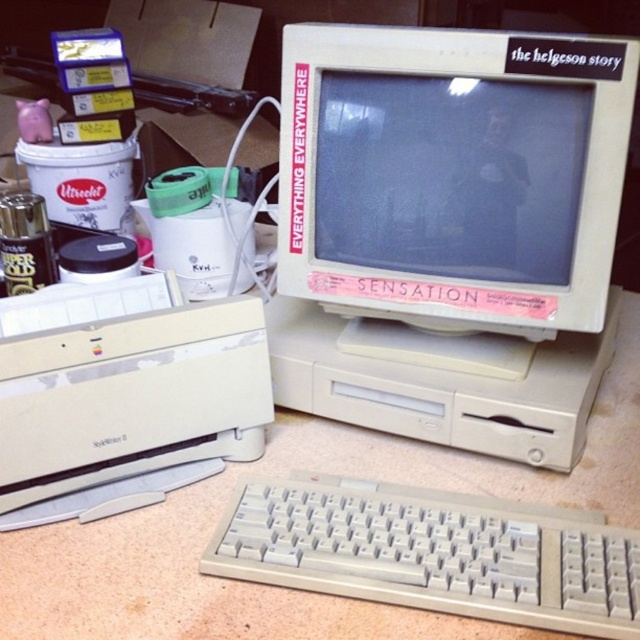
Question: Does white plastic monitor at center have a greater width compared to white plastic printer at lower left?

Choices:
 (A) no
 (B) yes

Answer: (B)

Question: Which object appears closest to the camera in this image?

Choices:
 (A) white plastic monitor at center
 (B) white plastic printer at lower left
 (C) matte plastic monitor at center
 (D) white plastic keyboard at lower center

Answer: (D)

Question: Among these objects, which one is nearest to the camera?

Choices:
 (A) white plastic keyboard at lower center
 (B) matte plastic monitor at center
 (C) white plastic printer at lower left

Answer: (A)

Question: Which of these objects is positioned farthest from the white plastic printer at lower left?

Choices:
 (A) white plastic keyboard at lower center
 (B) matte plastic monitor at center
 (C) white plastic monitor at center

Answer: (B)

Question: Does white plastic monitor at center have a larger size compared to white plastic printer at lower left?

Choices:
 (A) no
 (B) yes

Answer: (B)

Question: Is white plastic printer at lower left closer to camera compared to white plastic keyboard at lower center?

Choices:
 (A) yes
 (B) no

Answer: (B)